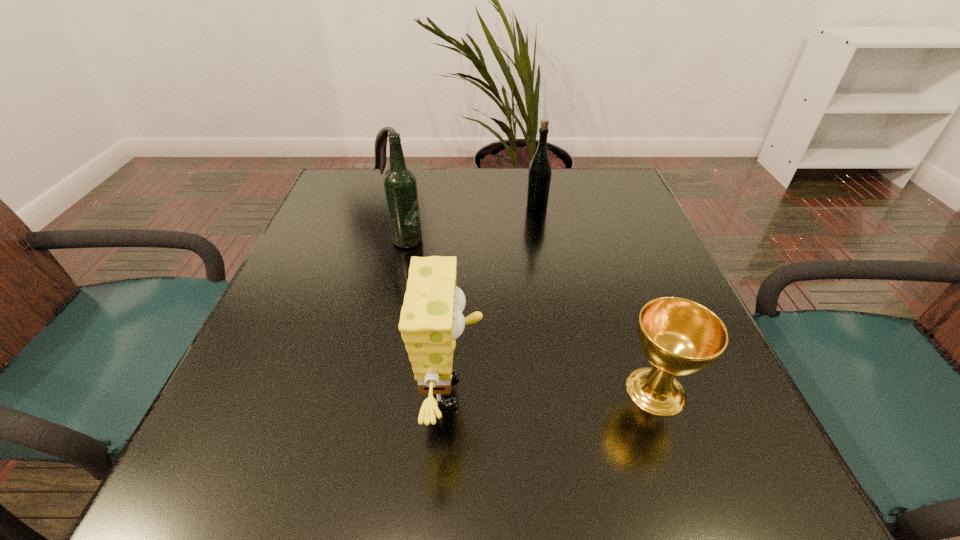
In the image, there is a desktop. Where is `vacant space at the far right corner`? vacant space at the far right corner is located at coordinates (578, 204).

In order to click on vacant space that's between the chalice and the left beer bottle in this screenshot , I will do `click(529, 316)`.

Locate an element on the screen. The image size is (960, 540). empty location between the right beer bottle and the shortest object is located at coordinates (596, 299).

Where is `vacant space that is in between the shorter beer bottle and the left beer bottle`? vacant space that is in between the shorter beer bottle and the left beer bottle is located at coordinates click(x=469, y=224).

The image size is (960, 540). I want to click on empty location between the right beer bottle and the sponge, so click(x=494, y=299).

You are a GUI agent. You are given a task and a screenshot of the screen. Output one action in this format:
    pyautogui.click(x=<x>, y=<y>)
    Task: Click on the empty space between the third object from right to left and the shortest object
    This screenshot has width=960, height=540.
    Given the screenshot: What is the action you would take?
    (553, 391)

This screenshot has width=960, height=540. Identify the location of vacant area that lies between the left beer bottle and the farthest object. (469, 224).

This screenshot has height=540, width=960. I want to click on free space between the rightmost object and the second object from left to right, so click(553, 391).

The image size is (960, 540). Identify the location of the third closest object relative to the chalice. (400, 185).

The image size is (960, 540). In order to click on object that is the second closest one to the left beer bottle in this screenshot , I will do `click(539, 177)`.